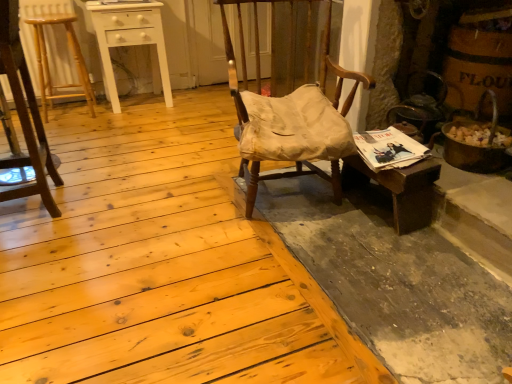
Locate an element on the screen. vacant area that lies between wooden chair with worn fabric cushion at center, the second chair positioned from the left, and white wood table at upper left is located at coordinates (179, 142).